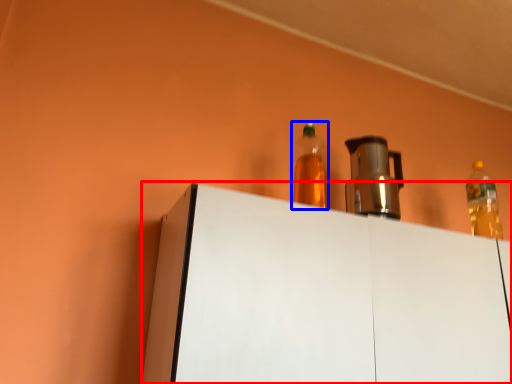
Question: Which point is further to the camera, furniture (highlighted by a red box) or bottle (highlighted by a blue box)?

Choices:
 (A) furniture
 (B) bottle

Answer: (B)